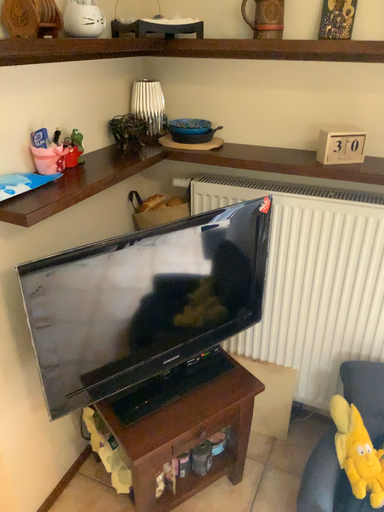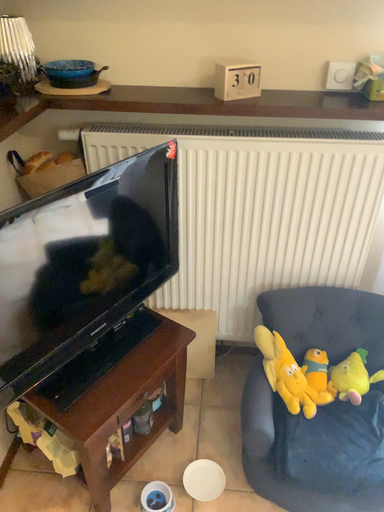
Question: How did the camera likely rotate when shooting the video?

Choices:
 (A) rotated left
 (B) rotated right

Answer: (B)